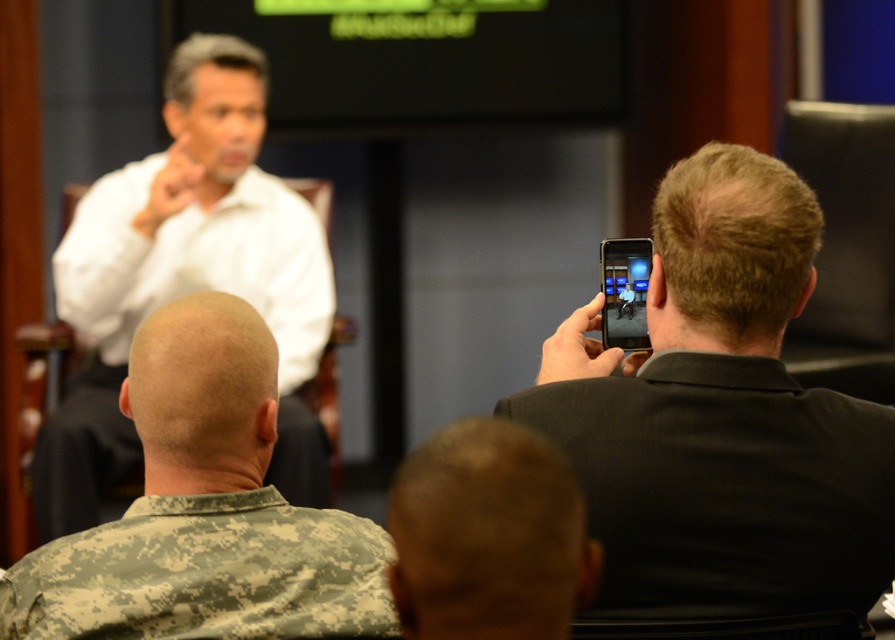
Question: Is camouflage uniform at lower left wider than camouflage fabric at lower left?

Choices:
 (A) no
 (B) yes

Answer: (A)

Question: Can you confirm if dark gray suit at upper right is smaller than camouflage uniform at lower left?

Choices:
 (A) no
 (B) yes

Answer: (A)

Question: Is camouflage uniform at lower left to the right of camouflage uniform at lower center from the viewer's perspective?

Choices:
 (A) yes
 (B) no

Answer: (B)

Question: Which object is positioned farthest from the camouflage fabric at lower left?

Choices:
 (A) white matte shirt at upper center
 (B) camouflage uniform at lower left

Answer: (A)

Question: Which of the following is the farthest from the observer?

Choices:
 (A) (520, 604)
 (B) (109, 188)
 (C) (355, 627)

Answer: (B)

Question: Which object is the closest to the camouflage fabric at lower left?

Choices:
 (A) dark gray suit at upper right
 (B) white matte shirt at upper center

Answer: (A)